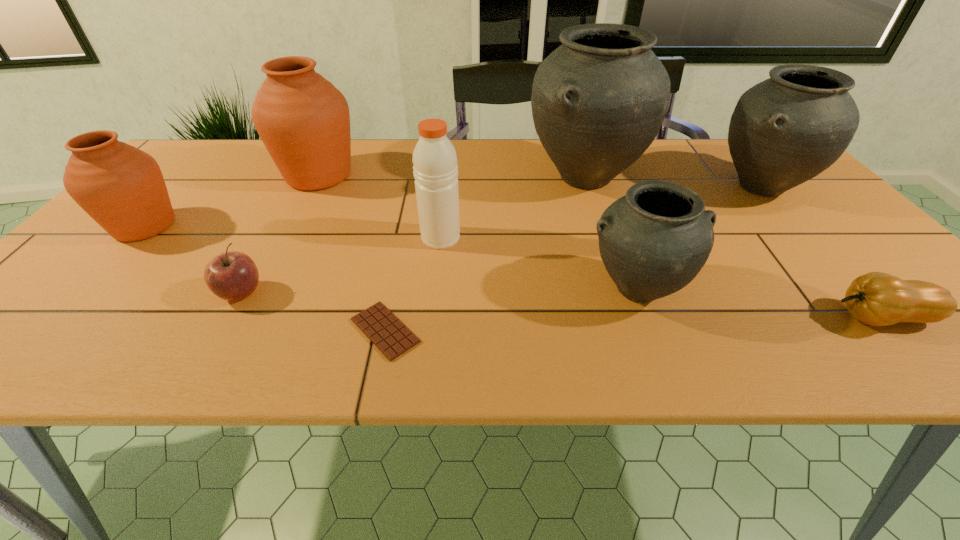
Image resolution: width=960 pixels, height=540 pixels. In order to click on vacant region located 0.070m on the back of the nearest black urn in this screenshot , I will do `click(617, 239)`.

You are a GUI agent. You are given a task and a screenshot of the screen. Output one action in this format:
    pyautogui.click(x=<x>, y=<y>)
    Task: Click on the free space located on the back of the apple
    
    Given the screenshot: What is the action you would take?
    (291, 204)

What are the coordinates of `vacant region located on the stem side of the gourd` in the screenshot? It's located at (731, 318).

This screenshot has width=960, height=540. Identify the location of free space located 0.340m on the stem side of the gourd. (653, 318).

Where is `vacant space located on the stem side of the gourd`? vacant space located on the stem side of the gourd is located at coordinates (669, 318).

You are a GUI agent. You are given a task and a screenshot of the screen. Output one action in this format:
    pyautogui.click(x=<x>, y=<y>)
    Task: Click on the vacant space located 0.340m on the right of the candy bar
    
    Given the screenshot: What is the action you would take?
    pyautogui.click(x=603, y=330)

This screenshot has height=540, width=960. What are the coordinates of `gourd present at the near edge` in the screenshot? It's located at (878, 299).

Identify the location of candy bar that is at the near edge. The width and height of the screenshot is (960, 540). (393, 338).

At what (x,y) coordinates should I click in order to perform the action: click on object that is positioned at the left edge. Please return your answer as a coordinate pair (x, y). This screenshot has width=960, height=540. Looking at the image, I should click on (121, 187).

At what (x,y) coordinates should I click in order to perform the action: click on urn situated at the right edge. Please return your answer as a coordinate pair (x, y). Looking at the image, I should click on (785, 130).